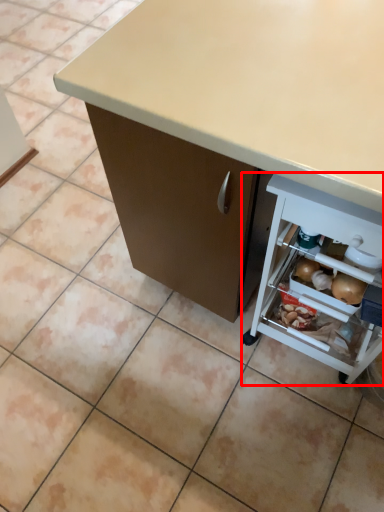
Question: Observing the image, what is the correct spatial positioning of shelf (annotated by the red box) in reference to desk?

Choices:
 (A) right
 (B) left

Answer: (A)